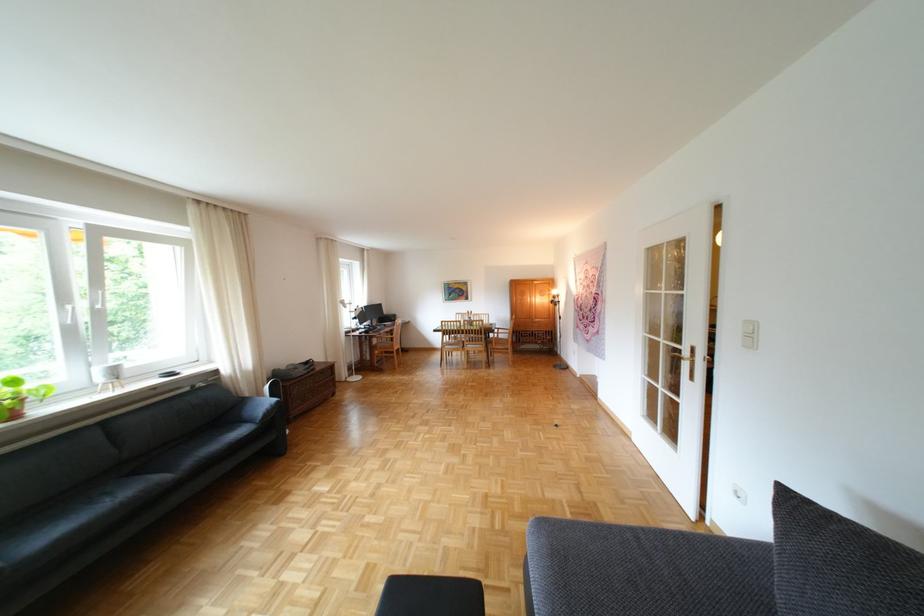
Where would you sit the gray sofa sitting surface? Please return your answer as a coordinate pair (x, y).

(614, 570)